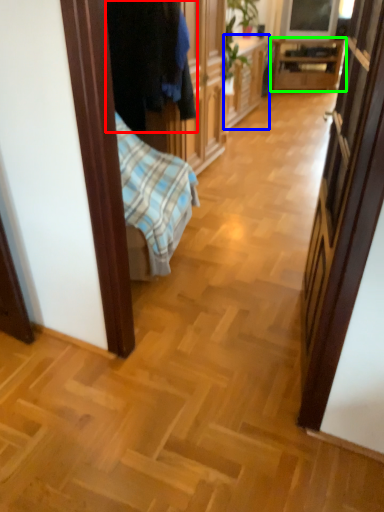
Question: Which is farther away from clothing (highlighted by a red box)? cabinetry (highlighted by a blue box) or table (highlighted by a green box)?

Choices:
 (A) cabinetry
 (B) table

Answer: (B)